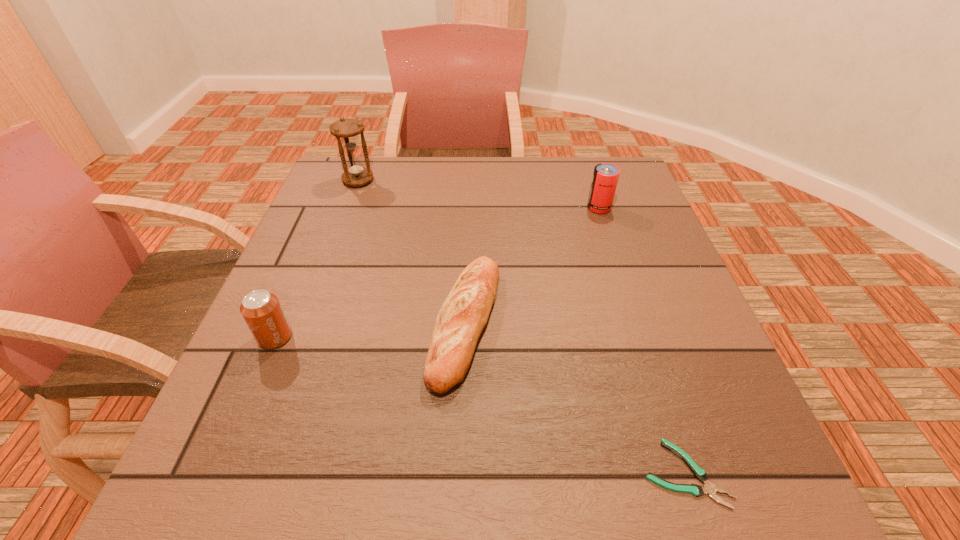
The height and width of the screenshot is (540, 960). What are the coordinates of `vacant space located 0.270m on the left of the fourth nearest object` in the screenshot? It's located at (486, 208).

Find the location of a particular element. vacant space located 0.130m on the back of the left can is located at coordinates (300, 279).

The width and height of the screenshot is (960, 540). I want to click on vacant space located on the back of the baguet, so click(x=469, y=199).

Where is `free space located 0.200m on the back of the pliers`? The image size is (960, 540). free space located 0.200m on the back of the pliers is located at coordinates (641, 341).

Locate an element on the screen. The image size is (960, 540). hourglass that is at the far edge is located at coordinates (346, 131).

Identify the location of can that is positioned at the far edge. (605, 177).

Locate an element on the screen. The image size is (960, 540). object at the near edge is located at coordinates (708, 488).

Where is `hourglass at the left edge`? The image size is (960, 540). hourglass at the left edge is located at coordinates (346, 131).

Identify the location of can at the left edge. The image size is (960, 540). (261, 310).

Find the location of a particular element. can that is positioned at the right edge is located at coordinates (605, 177).